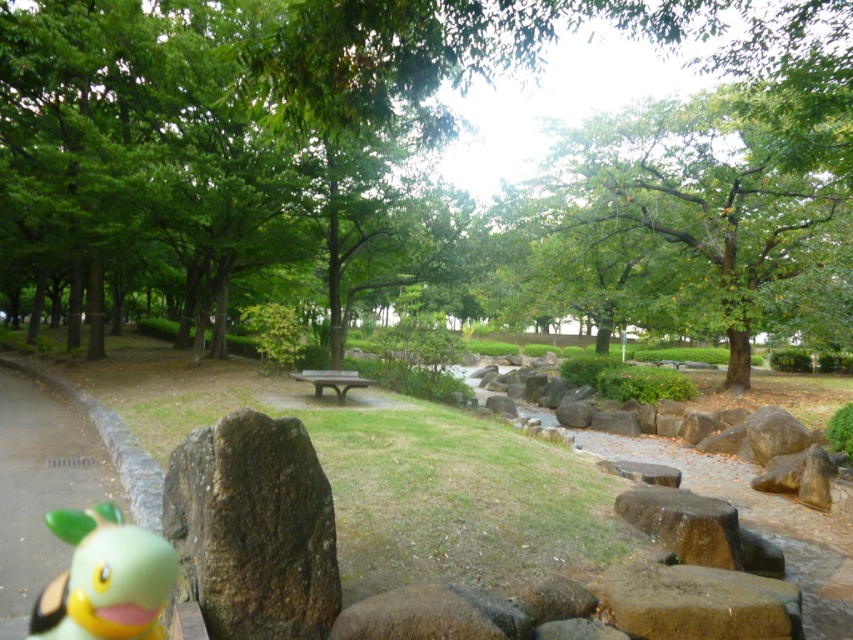
You are a park visitor who wants to sit on the dark brown wooden bench at center. However, there is a brown rough rock at lower left in your way. Can you walk around it to reach the bench?

The brown rough rock at lower left is above the dark brown wooden bench at center, so the rock is positioned higher up and not blocking the path. You can walk around it to reach the bench.

You are a painter setting up your easel in the park. You want to paint both the brown rough rock at lower left and the dark brown wooden bench at center. Which object should you position your easel closer to if you want to capture the rock in the foreground of your painting?

You should position your easel closer to the brown rough rock at lower left because it is in front of the dark brown wooden bench at center, making it naturally appear in the foreground when viewed from that angle.